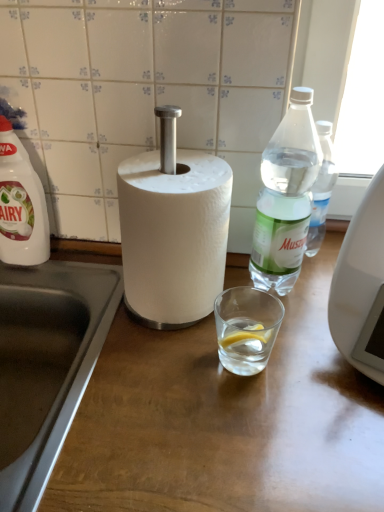
Question: Could you tell me if wooden at center is facing clear plastic bottle at right, marked as the first bottle in a right-to-left arrangement?

Choices:
 (A) no
 (B) yes

Answer: (A)

Question: Is wooden at center not within clear plastic bottle at right, the 2th bottle viewed from the left?

Choices:
 (A) yes
 (B) no

Answer: (A)

Question: Can you confirm if wooden at center is thinner than clear plastic bottle at right, marked as the first bottle in a right-to-left arrangement?

Choices:
 (A) yes
 (B) no

Answer: (B)

Question: From the image's perspective, is wooden at center under clear plastic bottle at right, the 2th bottle viewed from the left?

Choices:
 (A) no
 (B) yes

Answer: (B)

Question: Is wooden at center facing away from clear plastic bottle at right, the 2th bottle viewed from the left?

Choices:
 (A) yes
 (B) no

Answer: (B)

Question: In terms of size, does wooden at center appear bigger or smaller than clear plastic bottle at right, the 2th bottle viewed from the left?

Choices:
 (A) small
 (B) big

Answer: (B)

Question: From the image's perspective, is wooden at center above or below clear plastic bottle at right, the 2th bottle viewed from the left?

Choices:
 (A) above
 (B) below

Answer: (B)

Question: From a real-world perspective, is wooden at center positioned above or below clear plastic bottle at right, marked as the first bottle in a right-to-left arrangement?

Choices:
 (A) above
 (B) below

Answer: (B)

Question: Relative to clear plastic bottle at right, the 2th bottle viewed from the left, is wooden at center in front or behind?

Choices:
 (A) behind
 (B) front

Answer: (B)

Question: In the image, is stainless steel sink at lower left on the left side or the right side of white plastic bottle at left, the first bottle viewed from the left?

Choices:
 (A) right
 (B) left

Answer: (A)

Question: From a real-world perspective, is stainless steel sink at lower left positioned above or below white plastic bottle at left, marked as the second bottle in a right-to-left arrangement?

Choices:
 (A) above
 (B) below

Answer: (B)

Question: Looking at the image, does stainless steel sink at lower left seem bigger or smaller compared to white plastic bottle at left, the first bottle viewed from the left?

Choices:
 (A) small
 (B) big

Answer: (B)

Question: Considering the positions of point [36, 475] and point [9, 242], is point [36, 475] closer or farther from the camera than point [9, 242]?

Choices:
 (A) closer
 (B) farther

Answer: (A)

Question: From their relative heights in the image, would you say wooden at center is taller or shorter than white plastic bottle at left, the first bottle viewed from the left?

Choices:
 (A) short
 (B) tall

Answer: (B)

Question: From a real-world perspective, is wooden at center above or below white plastic bottle at left, marked as the second bottle in a right-to-left arrangement?

Choices:
 (A) below
 (B) above

Answer: (A)